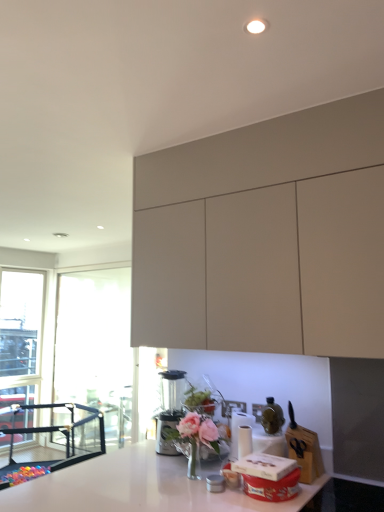
Question: From the image's perspective, relative to black mesh playpen at lower left, is pink glass vase at center above or below?

Choices:
 (A) above
 (B) below

Answer: (A)

Question: Do you think pink glass vase at center is within black mesh playpen at lower left, or outside of it?

Choices:
 (A) outside
 (B) inside

Answer: (A)

Question: Based on their relative distances, which object is nearer to the satin silver blender at lower center?

Choices:
 (A) pink glass vase at center
 (B) matte white cabinets at upper center
 (C) black mesh playpen at lower left

Answer: (A)

Question: Which object is positioned closest to the black mesh playpen at lower left?

Choices:
 (A) satin silver blender at lower center
 (B) matte white cabinets at upper center
 (C) pink glass vase at center

Answer: (A)